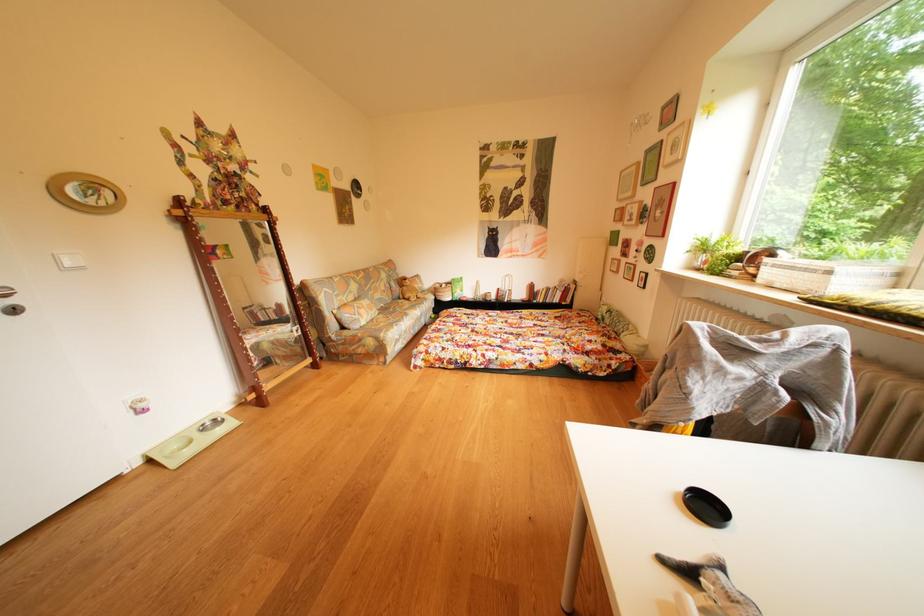
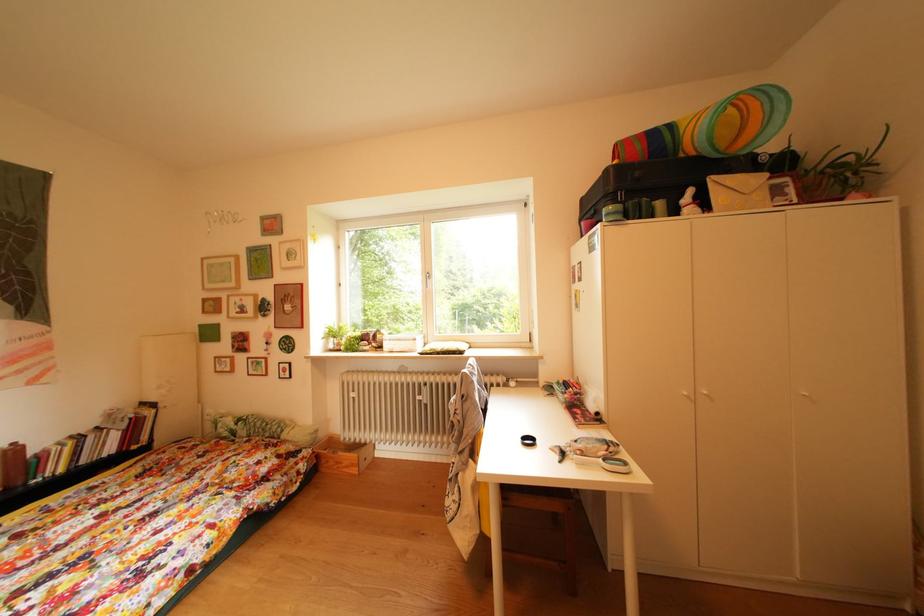
Question: The camera is either moving clockwise (left) or counter-clockwise (right) around the object. The first image is from the beginning of the video and the second image is from the end. Is the camera moving left or right when shooting the video?

Choices:
 (A) Left
 (B) Right

Answer: (A)